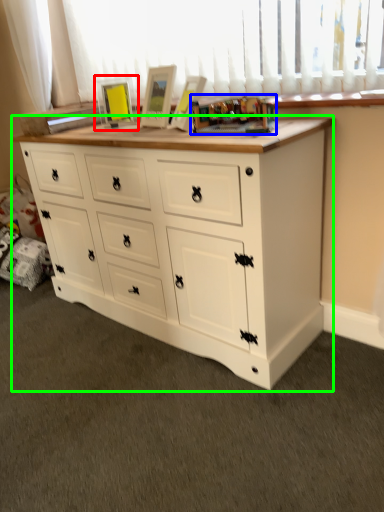
Question: Based on their relative distances, which object is nearer to picture frame (highlighted by a red box)? Choose from toy (highlighted by a blue box) and chest of drawers (highlighted by a green box).

Choices:
 (A) toy
 (B) chest of drawers

Answer: (A)